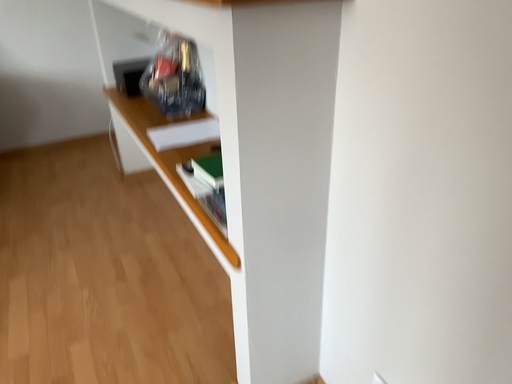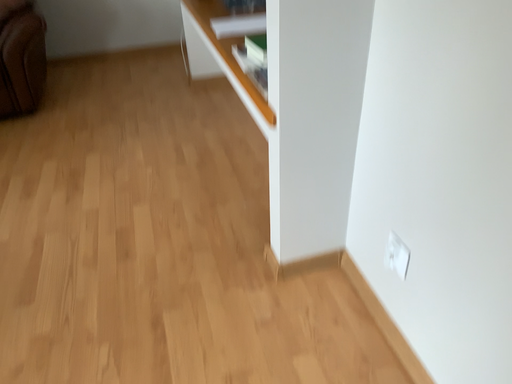
Question: Which way did the camera rotate in the video?

Choices:
 (A) rotated upward
 (B) rotated downward

Answer: (B)